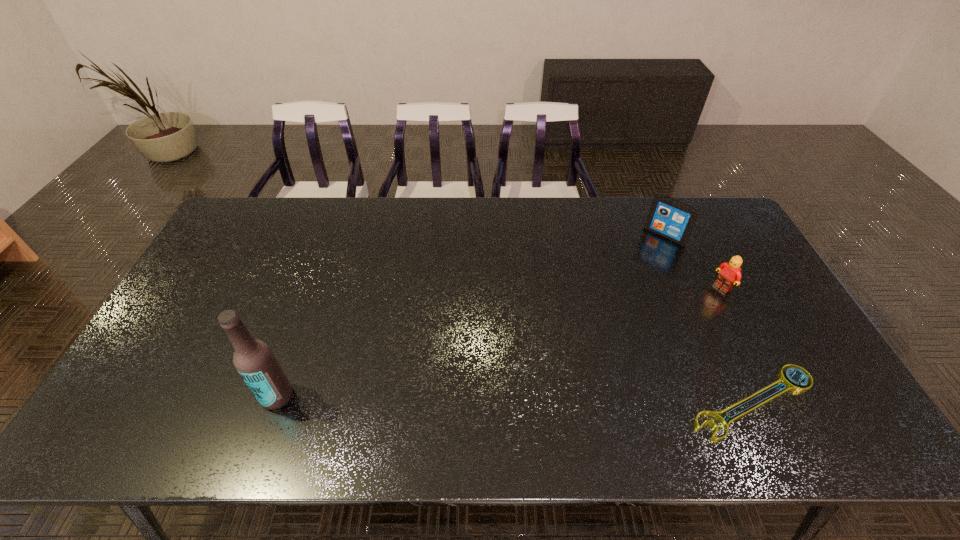
I want to click on vacant spot on the desktop that is between the leftmost object and the wrench and is positioned on the front screen of the iPod, so click(521, 399).

Where is `free spot on the desktop that is between the leftmost object and the wrench and is positioned on the face of the third nearest object`? This screenshot has width=960, height=540. free spot on the desktop that is between the leftmost object and the wrench and is positioned on the face of the third nearest object is located at coordinates (519, 399).